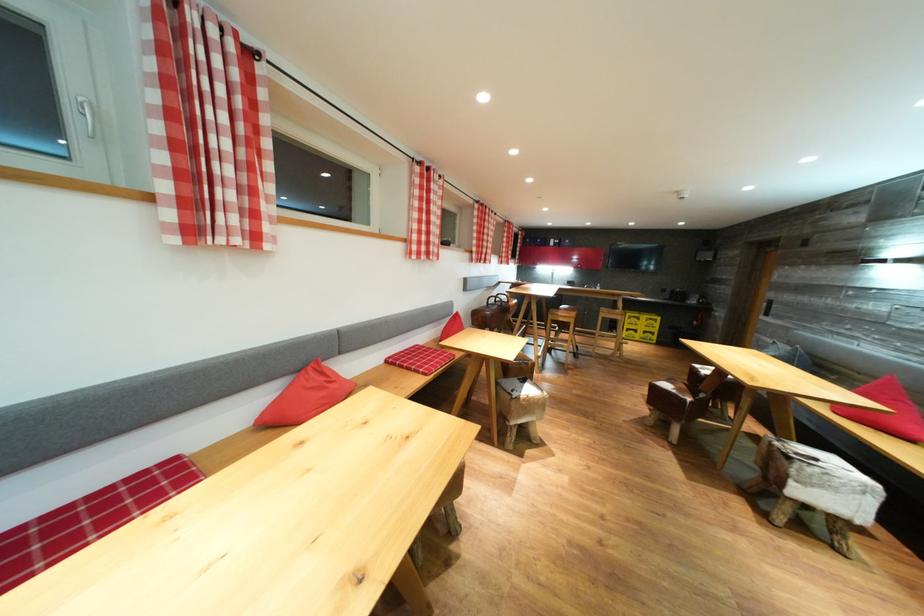
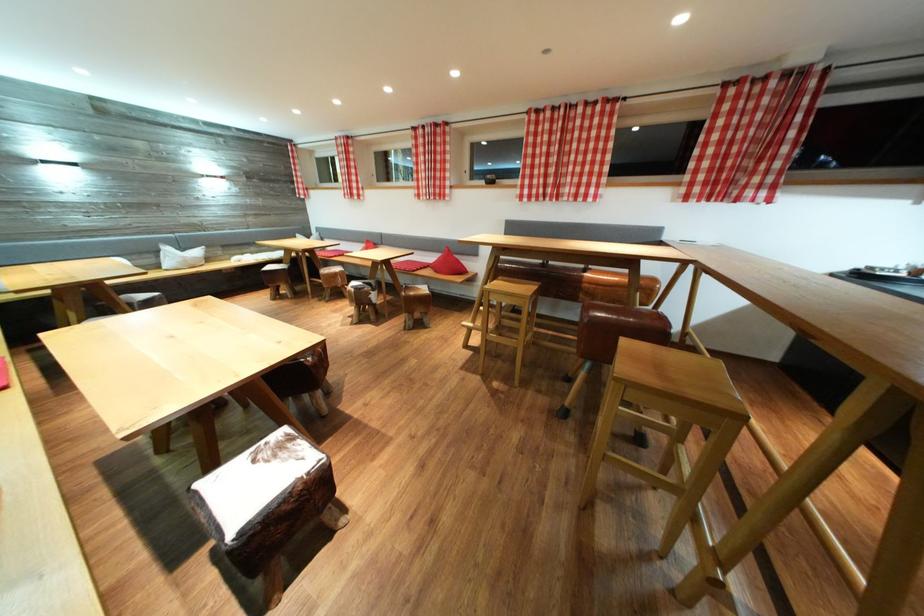
Question: I am providing you with two images of the same scene from different viewpoints. Which of the following objects are not visible in image2?

Choices:
 (A) brown leather stool
 (B) chair sitting surface
 (C) red triangular pillow
 (D) decorative pot handle

Answer: (B)